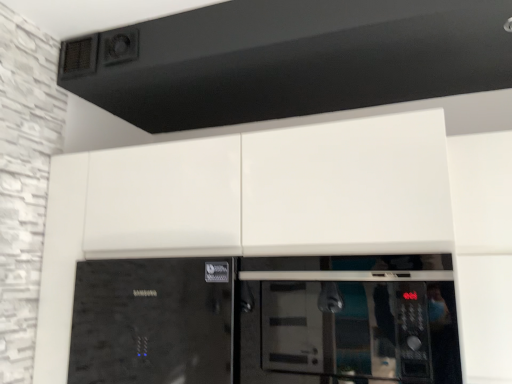
Question: Can we say glossy white cabinet at center lies outside black textured exhaust hood at upper center?

Choices:
 (A) no
 (B) yes

Answer: (B)

Question: From a real-world perspective, is glossy white cabinet at center located higher than black textured exhaust hood at upper center?

Choices:
 (A) no
 (B) yes

Answer: (A)

Question: Is glossy white cabinet at center next to black textured exhaust hood at upper center and touching it?

Choices:
 (A) yes
 (B) no

Answer: (B)

Question: Is glossy white cabinet at center shorter than black textured exhaust hood at upper center?

Choices:
 (A) no
 (B) yes

Answer: (A)

Question: From the image's perspective, is glossy white cabinet at center above black textured exhaust hood at upper center?

Choices:
 (A) no
 (B) yes

Answer: (A)

Question: Considering the relative sizes of glossy white cabinet at center and black textured exhaust hood at upper center in the image provided, is glossy white cabinet at center bigger than black textured exhaust hood at upper center?

Choices:
 (A) no
 (B) yes

Answer: (B)

Question: From a real-world perspective, is black textured exhaust hood at upper center positioned over black glass microwave at center based on gravity?

Choices:
 (A) yes
 (B) no

Answer: (A)

Question: Is black glass microwave at center at the back of black textured exhaust hood at upper center?

Choices:
 (A) yes
 (B) no

Answer: (B)

Question: Does black textured exhaust hood at upper center have a greater height compared to black glass microwave at center?

Choices:
 (A) yes
 (B) no

Answer: (B)

Question: Considering the relative positions of black textured exhaust hood at upper center and black glass microwave at center in the image provided, is black textured exhaust hood at upper center behind black glass microwave at center?

Choices:
 (A) yes
 (B) no

Answer: (A)

Question: Can you confirm if black textured exhaust hood at upper center is bigger than black glass microwave at center?

Choices:
 (A) no
 (B) yes

Answer: (B)

Question: From the image's perspective, is black textured exhaust hood at upper center beneath black glass microwave at center?

Choices:
 (A) yes
 (B) no

Answer: (B)

Question: From the image's perspective, is black textured exhaust hood at upper center under glossy white cabinet at center?

Choices:
 (A) no
 (B) yes

Answer: (A)